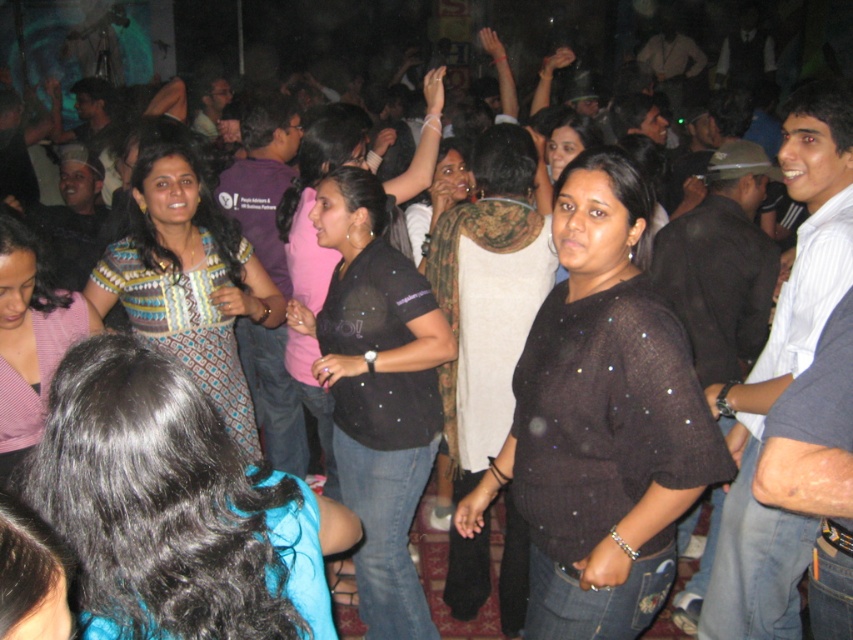
Question: Is patterned fabric dress at center smaller than black textured shirt at center?

Choices:
 (A) yes
 (B) no

Answer: (B)

Question: Is blue fabric dress at center positioned in front of patterned fabric dress at center?

Choices:
 (A) no
 (B) yes

Answer: (B)

Question: Which object is positioned farthest from the black textured shirt at center?

Choices:
 (A) black glittery shirt at center
 (B) blue fabric dress at center

Answer: (B)

Question: Which object is positioned closest to the black mesh top at center?

Choices:
 (A) black glittery shirt at center
 (B) patterned fabric dress at center
 (C) black textured shirt at center

Answer: (A)

Question: Which object appears closest to the camera in this image?

Choices:
 (A) black mesh top at center
 (B) patterned fabric blouse at left
 (C) patterned fabric dress at center
 (D) black textured shirt at center

Answer: (A)

Question: Does black mesh top at center have a smaller size compared to black textured shirt at center?

Choices:
 (A) yes
 (B) no

Answer: (B)